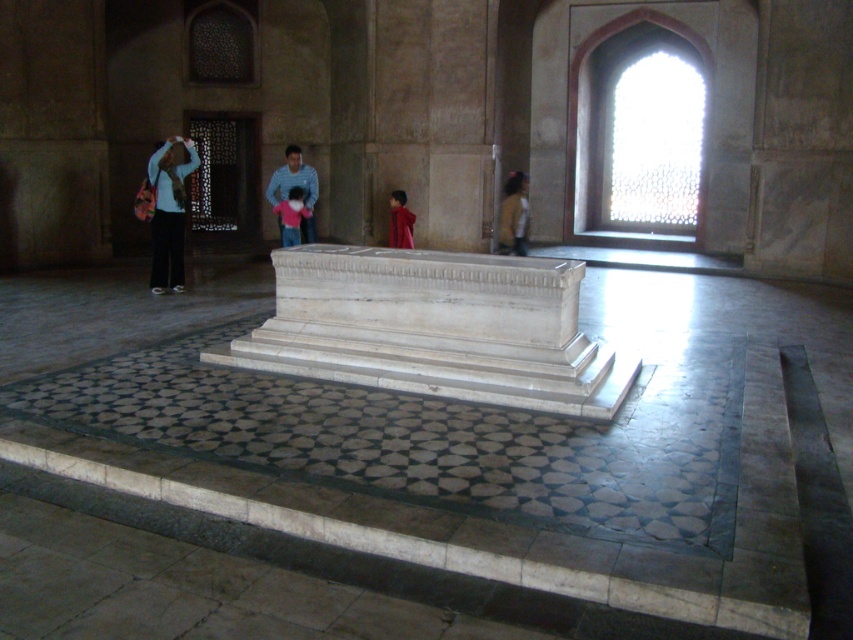
Who is more forward, (273, 172) or (300, 212)?

Positioned in front is point (300, 212).

Which of these two, striped cotton shirt at center or light blue shirt at center, stands taller?

striped cotton shirt at center

Between point (316, 182) and point (289, 244), which one is positioned in front?

Point (289, 244)

In order to click on striped cotton shirt at center in this screenshot , I will do `click(292, 179)`.

Between matte blue shirt at left and yellow matte shirt at right, which one appears on the right side from the viewer's perspective?

From the viewer's perspective, yellow matte shirt at right appears more on the right side.

Does matte blue shirt at left have a lesser height compared to yellow matte shirt at right?

Incorrect, matte blue shirt at left's height does not fall short of yellow matte shirt at right's.

Who is more forward, (166, 188) or (498, 227)?

Point (166, 188) is in front.

What are the coordinates of `matte blue shirt at left` in the screenshot? It's located at (167, 212).

Who is taller, yellow matte shirt at right or light blue shirt at center?

yellow matte shirt at right

Is point (509, 211) positioned before point (299, 220)?

That is False.

Where is `yellow matte shirt at right`? The width and height of the screenshot is (853, 640). yellow matte shirt at right is located at coordinates (514, 216).